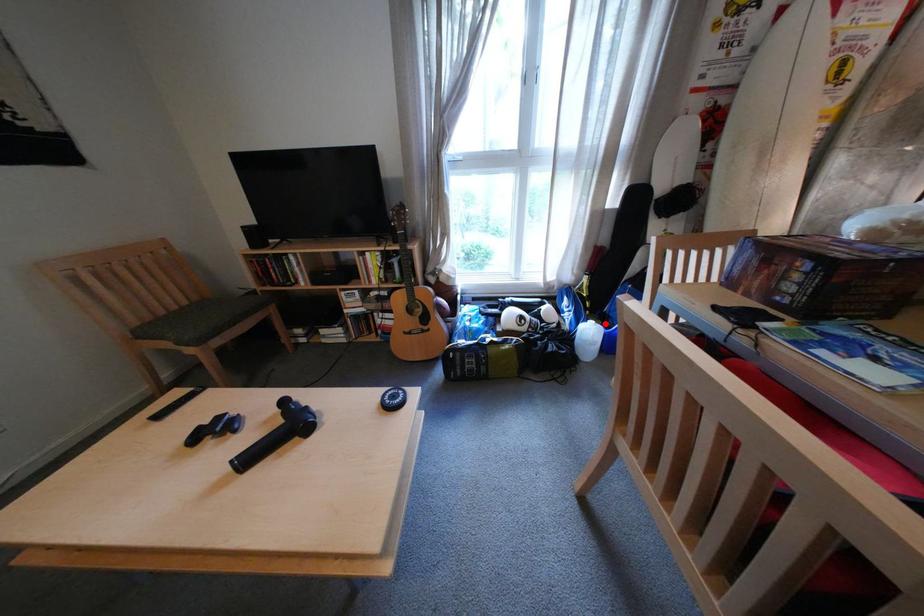
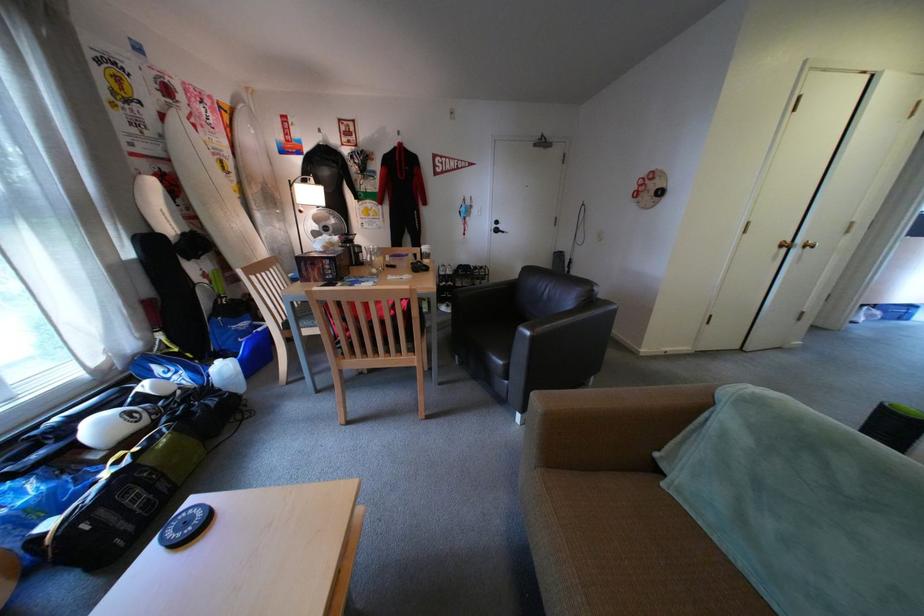
Locate, in the second image, the point that corresponds to the highlighted location in the first image.

(233, 363)